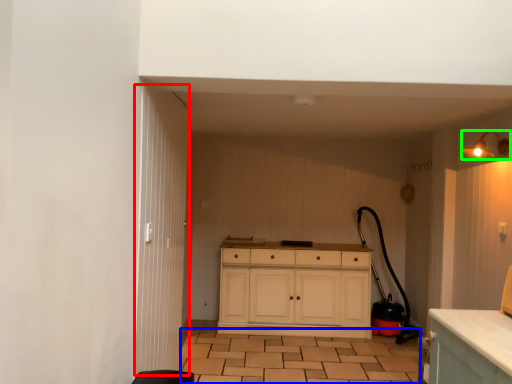
Question: Which is farther away from door (highlighted by a red box)? tile (highlighted by a blue box) or light fixture (highlighted by a green box)?

Choices:
 (A) tile
 (B) light fixture

Answer: (B)